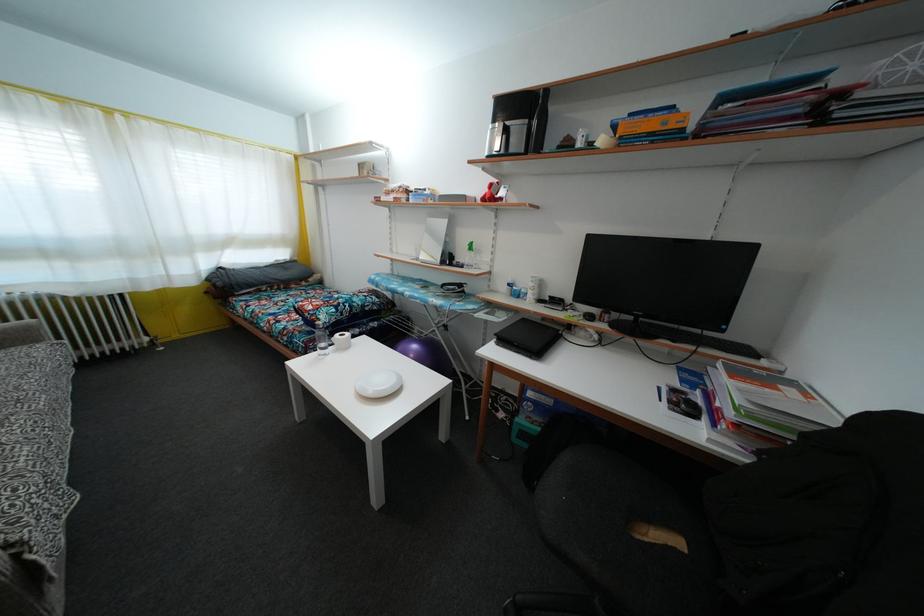
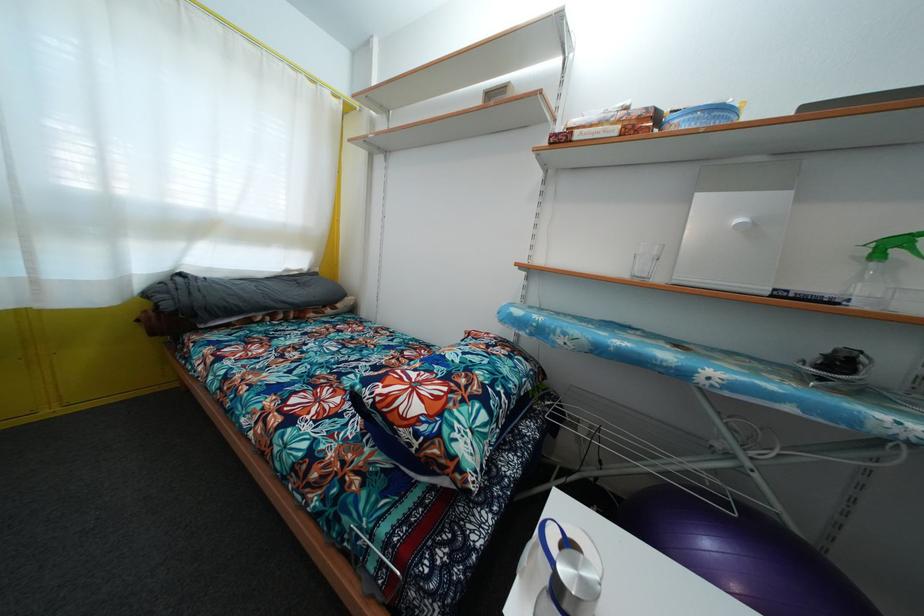
What movement of the cameraman would produce the second image?

The cameraman walked toward left, forward.